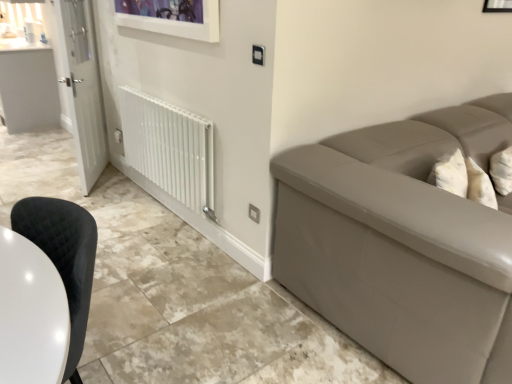
Question: Is black quilted fabric chair at lower left taller or shorter than white glossy counter top at upper left?

Choices:
 (A) tall
 (B) short

Answer: (B)

Question: From a real-world perspective, is black quilted fabric chair at lower left above or below white glossy counter top at upper left?

Choices:
 (A) above
 (B) below

Answer: (B)

Question: Considering the real-world distances, which object is closest to the white glossy door at left?

Choices:
 (A) white glossy radiator at lower left
 (B) white glossy counter top at upper left
 (C) black quilted fabric chair at lower left

Answer: (A)

Question: Which object is positioned farthest from the white glossy door at left?

Choices:
 (A) black quilted fabric chair at lower left
 (B) white glossy radiator at lower left
 (C) white glossy counter top at upper left

Answer: (A)